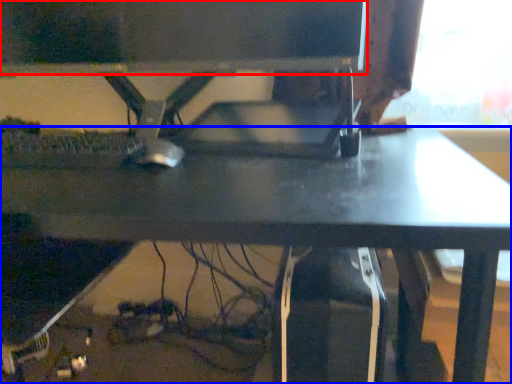
Question: Which point is closer to the camera, computer monitor (highlighted by a red box) or desk (highlighted by a blue box)?

Choices:
 (A) computer monitor
 (B) desk

Answer: (B)